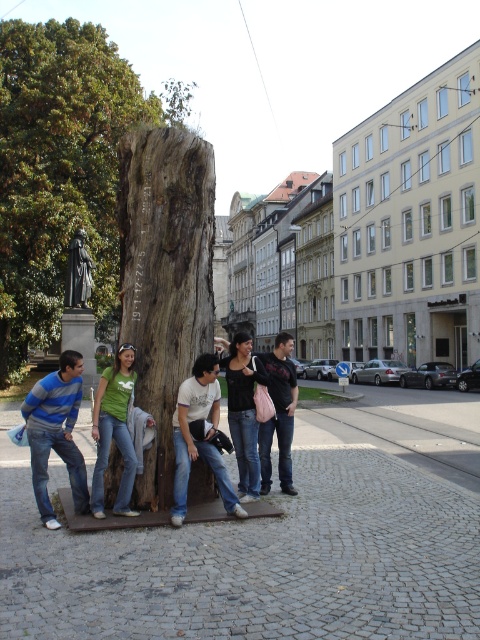
Looking at this image, you are standing in the plaza and want to take a photo of both the rough wooden trunk at center and the green matte shirt at center. Since you can only focus on one object at a time, which one should you adjust your camera to focus on first to ensure it appears in the foreground?

You should focus on the rough wooden trunk at center first because it is positioned to the left of the green matte shirt at center, making it closer to the camera and thus in the foreground.